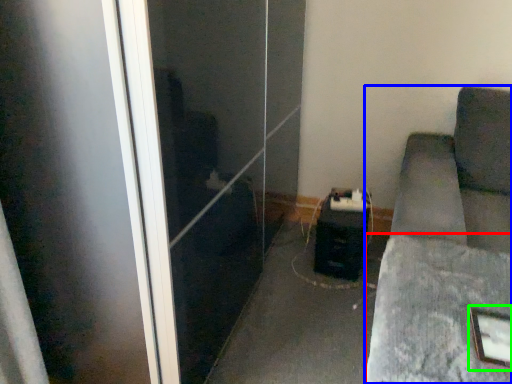
Question: Which is nearer to the concrete (highlighted by a red box)? furniture (highlighted by a blue box) or picture frame (highlighted by a green box).

Choices:
 (A) furniture
 (B) picture frame

Answer: (A)